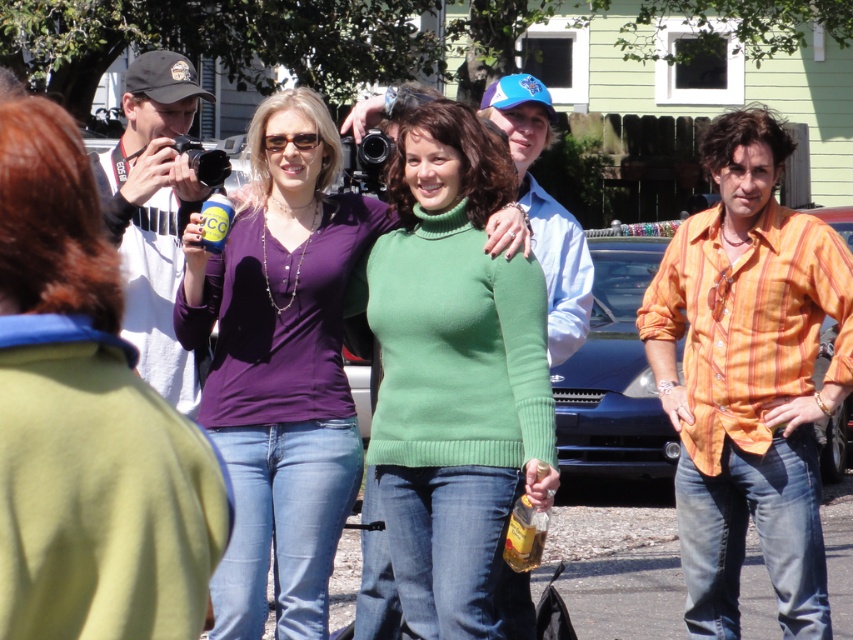
Question: Does green knitted sweater at center have a greater width compared to white cotton t-shirt at left?

Choices:
 (A) no
 (B) yes

Answer: (B)

Question: Among these objects, which one is farthest from the camera?

Choices:
 (A) white cotton t-shirt at left
 (B) matte black camera at left
 (C) orange striped shirt at right

Answer: (C)

Question: Does matte black camera at left have a larger size compared to green knitted sweater at center?

Choices:
 (A) yes
 (B) no

Answer: (B)

Question: Does matte black camera at left appear under matte purple shirt at center?

Choices:
 (A) no
 (B) yes

Answer: (A)

Question: Which object appears closest to the camera in this image?

Choices:
 (A) matte purple shirt at center
 (B) white cotton t-shirt at left

Answer: (A)

Question: Which of the following is the farthest from the observer?

Choices:
 (A) (310, 426)
 (B) (30, 509)
 (C) (144, 230)

Answer: (C)